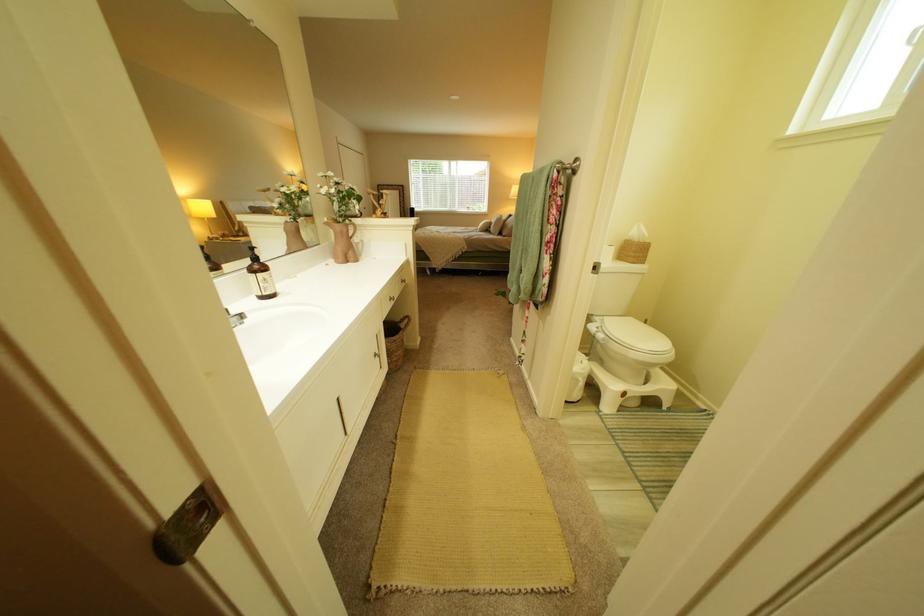
Where is `silver faucet handle`? The height and width of the screenshot is (616, 924). silver faucet handle is located at coordinates (236, 317).